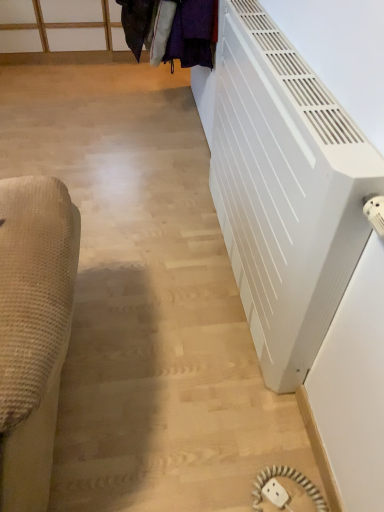
At what (x,y) coordinates should I click in order to perform the action: click on free area below velvet purple coat at upper center (from a real-world perspective). Please return your answer as a coordinate pair (x, y). This screenshot has height=512, width=384. Looking at the image, I should click on (169, 121).